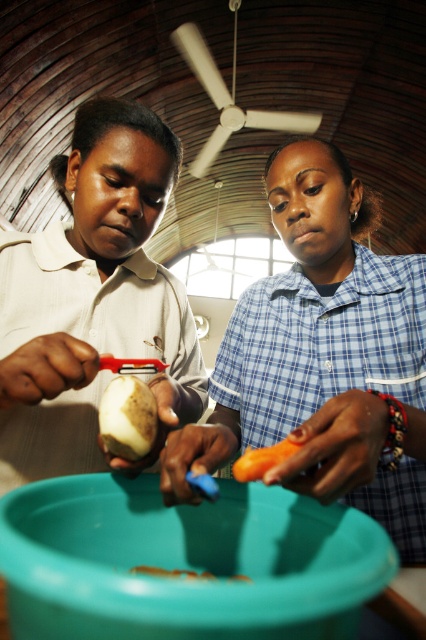
Who is more forward, (175,282) or (100,417)?

Point (100,417)

Is matte white potato at left above smooth white potato at center?

Correct, matte white potato at left is located above smooth white potato at center.

Which is in front, point (11, 371) or point (123, 401)?

Point (123, 401)

The height and width of the screenshot is (640, 426). In order to click on matte white potato at left in this screenshot , I will do `click(94, 300)`.

Who is taller, matte blue shirt at center or orange smooth carrot at center?

With more height is matte blue shirt at center.

Is point (411, 461) farther from viewer compared to point (236, 470)?

Yes, point (411, 461) is farther from viewer.

Is point (411, 284) farther from camera compared to point (250, 465)?

That is True.

The height and width of the screenshot is (640, 426). Find the location of `matte blue shirt at center`. matte blue shirt at center is located at coordinates (321, 356).

Is point (95, 326) farther from viewer compared to point (282, 460)?

Yes, point (95, 326) is behind point (282, 460).

Which is above, matte white potato at left or orange smooth carrot at center?

matte white potato at left is higher up.

The image size is (426, 640). What do you see at coordinates (94, 300) in the screenshot? I see `matte white potato at left` at bounding box center [94, 300].

Where is `matte white potato at left`? This screenshot has height=640, width=426. matte white potato at left is located at coordinates (94, 300).